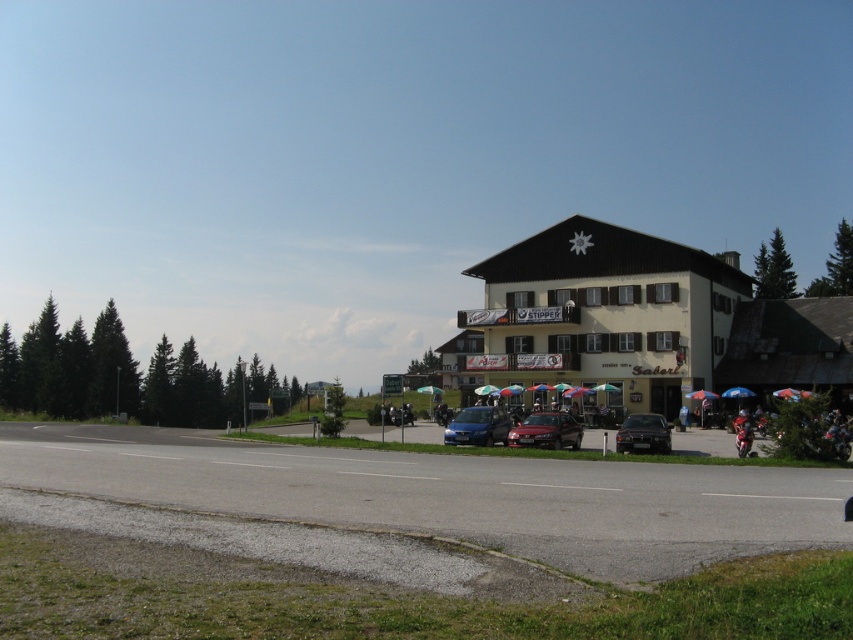
Question: Which point is closer to the camera?

Choices:
 (A) wooden umbrella at center
 (B) shiny chrome motorcycle at center

Answer: (B)

Question: Is satin silver sedan at center positioned before shiny chrome motorcycle at center?

Choices:
 (A) no
 (B) yes

Answer: (B)

Question: Can you confirm if gravel road at lower left is positioned below shiny chrome motorcycle at center?

Choices:
 (A) yes
 (B) no

Answer: (B)

Question: Is beige wooden building at center to the left of green textured pine at upper right from the viewer's perspective?

Choices:
 (A) yes
 (B) no

Answer: (A)

Question: Which point is farther to the camera?

Choices:
 (A) satin black sedan at center
 (B) beige wooden building at center
 (C) green textured pine at upper right
 (D) gravel road at lower left

Answer: (C)

Question: Which object is the farthest from the green textured pine at left?

Choices:
 (A) matte black car at center
 (B) gravel road at lower left
 (C) satin black sedan at center

Answer: (A)